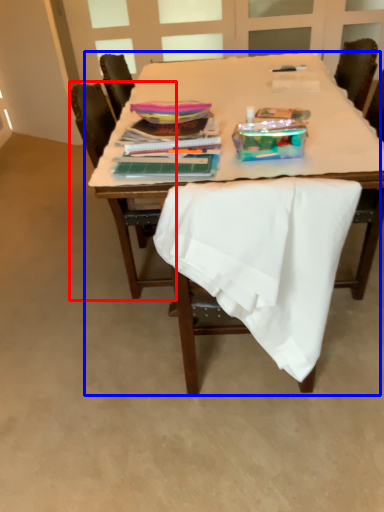
Question: Which of the following is the closest to the observer, chair (highlighted by a red box) or table (highlighted by a blue box)?

Choices:
 (A) chair
 (B) table

Answer: (B)